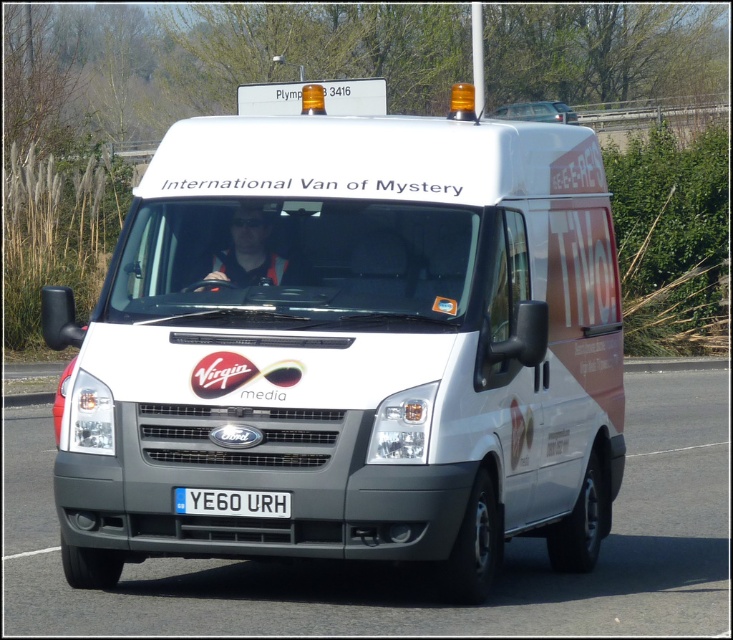
Question: Where is white matte van at center located in relation to white rectangular license plate at center in the image?

Choices:
 (A) left
 (B) right

Answer: (B)

Question: Does white matte van at center appear under white rectangular license plate at center?

Choices:
 (A) yes
 (B) no

Answer: (B)

Question: Among these points, which one is nearest to the camera?

Choices:
 (A) (556, 230)
 (B) (183, 488)

Answer: (B)

Question: Can you confirm if white matte van at center is bigger than white rectangular license plate at center?

Choices:
 (A) no
 (B) yes

Answer: (B)